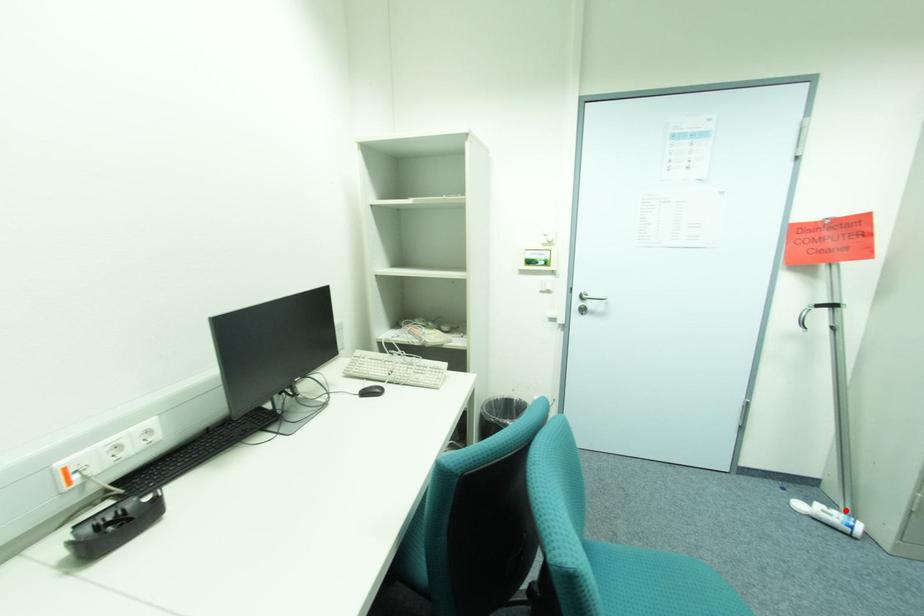
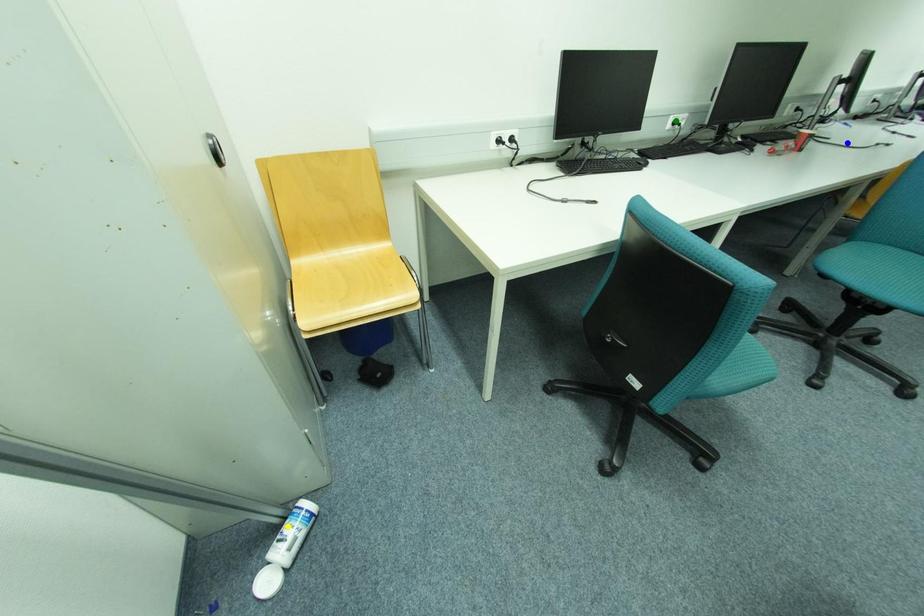
Question: I am providing you with two images of the same scene from different viewpoints. A red point is marked on the first image. You are given multiple points on the second image. Which spot in image 2 lines up with the point in image 1?

Choices:
 (A) green point
 (B) blue point
 (C) yellow point

Answer: (C)